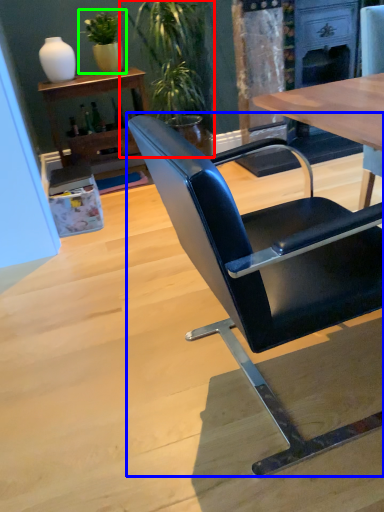
Question: Which is farther away from houseplant (highlighted by a red box)? chair (highlighted by a blue box) or houseplant (highlighted by a green box)?

Choices:
 (A) chair
 (B) houseplant

Answer: (A)